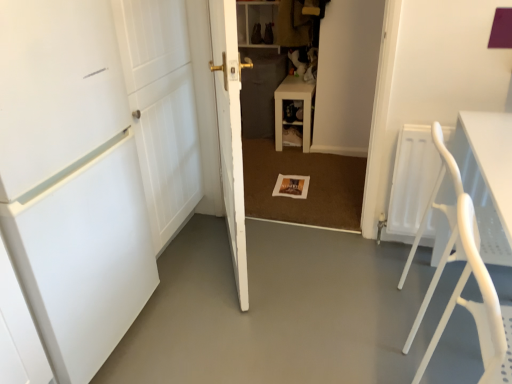
In order to face white matte door at left, which is the 1th door in left-to-right order, should I rotate leftwards or rightwards?

It's best to rotate left around 28.902 degrees.

Where is `white matte door at left, which is the 1th door in left-to-right order`? The height and width of the screenshot is (384, 512). white matte door at left, which is the 1th door in left-to-right order is located at coordinates (71, 181).

The height and width of the screenshot is (384, 512). What are the coordinates of `white plastic folding chair at right` in the screenshot? It's located at (448, 223).

Find the location of a particular element. The image size is (512, 384). wooden shelf at center is located at coordinates (294, 100).

The height and width of the screenshot is (384, 512). I want to click on white matte door at center, the 1th door from the right, so click(230, 134).

Locate an element on the screen. Image resolution: width=512 pixels, height=384 pixels. smooth concrete floor at center is located at coordinates click(281, 310).

Is white matte door at center, the second door when ordered from left to right, smaller than white matte door at left, which is the 1th door in left-to-right order?

Correct, white matte door at center, the second door when ordered from left to right, occupies less space than white matte door at left, which is the 1th door in left-to-right order.

Is white matte door at center, the 1th door from the right, far from white matte door at left, which is the 1th door in left-to-right order?

No, there isn't a large distance between white matte door at center, the 1th door from the right, and white matte door at left, which is the 1th door in left-to-right order.

Considering the points (214, 51) and (129, 208), which point is in front, point (214, 51) or point (129, 208)?

The point (129, 208) is closer.

Is white matte door at center, the second door when ordered from left to right, completely or partially outside of white matte door at left, which is the 1th door in left-to-right order?

Yes, white matte door at center, the second door when ordered from left to right, is outside of white matte door at left, which is the 1th door in left-to-right order.

From the image's perspective, is white plastic folding chair at right positioned above or below white matte door at left, the second door in the right-to-left sequence?

white plastic folding chair at right is below white matte door at left, the second door in the right-to-left sequence.

Is white plastic folding chair at right looking in the opposite direction of white matte door at left, the second door in the right-to-left sequence?

Yes, white plastic folding chair at right's orientation is away from white matte door at left, the second door in the right-to-left sequence.

Based on the photo, can you confirm if white plastic folding chair at right is shorter than white matte door at left, the second door in the right-to-left sequence?

Correct, white plastic folding chair at right is not as tall as white matte door at left, the second door in the right-to-left sequence.

Where is `folding chair behind the white matte door at left, the second door in the right-to-left sequence`? Image resolution: width=512 pixels, height=384 pixels. folding chair behind the white matte door at left, the second door in the right-to-left sequence is located at coordinates (448, 223).

Can you confirm if wooden shelf at center is shorter than white plastic folding chair at right?

Correct, wooden shelf at center is not as tall as white plastic folding chair at right.

Considering the relative positions of wooden shelf at center and white plastic folding chair at right in the image provided, is wooden shelf at center to the right of white plastic folding chair at right from the viewer's perspective?

No, wooden shelf at center is not to the right of white plastic folding chair at right.

Is wooden shelf at center spatially inside white plastic folding chair at right, or outside of it?

wooden shelf at center exists outside the volume of white plastic folding chair at right.

Is wooden shelf at center positioned far away from white plastic folding chair at right?

Yes.

Between white matte door at left, the second door in the right-to-left sequence, and white matte door at center, the 1th door from the right, which one is positioned in front?

white matte door at left, the second door in the right-to-left sequence, is in front.

In the scene shown: In terms of height, does white matte door at left, the second door in the right-to-left sequence, look taller or shorter compared to white matte door at center, the 1th door from the right?

white matte door at left, the second door in the right-to-left sequence, is taller than white matte door at center, the 1th door from the right.

Where is `door below the white matte door at left, the second door in the right-to-left sequence (from a real-world perspective)`? The height and width of the screenshot is (384, 512). door below the white matte door at left, the second door in the right-to-left sequence (from a real-world perspective) is located at coordinates (230, 134).

Which object is closer to the camera, white matte door at center, the 1th door from the right, or smooth concrete floor at center?

Positioned in front is smooth concrete floor at center.

Considering the positions of objects white matte door at center, the second door when ordered from left to right, and smooth concrete floor at center in the image provided, who is more to the right, white matte door at center, the second door when ordered from left to right, or smooth concrete floor at center?

smooth concrete floor at center is more to the right.

The width and height of the screenshot is (512, 384). Identify the location of door that is the 1st one above the smooth concrete floor at center (from a real-world perspective). (230, 134).

Which of these two, white matte door at center, the second door when ordered from left to right, or smooth concrete floor at center, is smaller?

smooth concrete floor at center is smaller.

Can you confirm if wooden shelf at center is positioned to the left of white matte door at center, the 1th door from the right?

Incorrect, wooden shelf at center is not on the left side of white matte door at center, the 1th door from the right.

Which object is wider, wooden shelf at center or white matte door at center, the second door when ordered from left to right?

wooden shelf at center.

Looking at this image, would you say wooden shelf at center is inside or outside white matte door at center, the 1th door from the right?

wooden shelf at center is outside white matte door at center, the 1th door from the right.

Is wooden shelf at center positioned with its back to white matte door at center, the 1th door from the right?

wooden shelf at center does not have its back to white matte door at center, the 1th door from the right.

Is smooth concrete floor at center facing away from white plastic folding chair at right?

smooth concrete floor at center is not turned away from white plastic folding chair at right.

Between smooth concrete floor at center and white plastic folding chair at right, which one has smaller width?

white plastic folding chair at right.

How many degrees apart are the facing directions of smooth concrete floor at center and white plastic folding chair at right?

They differ by 90 degrees in their facing directions.

Where is `door above the white matte door at left, the second door in the right-to-left sequence (from the image's perspective)`? Image resolution: width=512 pixels, height=384 pixels. door above the white matte door at left, the second door in the right-to-left sequence (from the image's perspective) is located at coordinates (230, 134).

Where is `folding chair that appears below the white matte door at left, the second door in the right-to-left sequence (from a real-world perspective)`? This screenshot has width=512, height=384. folding chair that appears below the white matte door at left, the second door in the right-to-left sequence (from a real-world perspective) is located at coordinates (448, 223).

From the image, which object appears to be farther from white matte door at left, the second door in the right-to-left sequence, wooden shelf at center or white matte door at center, the second door when ordered from left to right?

Among the two, wooden shelf at center is located further to white matte door at left, the second door in the right-to-left sequence.

Considering their positions, is white matte door at left, the second door in the right-to-left sequence, positioned closer to white matte door at center, the second door when ordered from left to right, than white plastic folding chair at right?

white matte door at left, the second door in the right-to-left sequence, lies closer to white matte door at center, the second door when ordered from left to right, than the other object.

From the image, which object appears to be farther from white plastic folding chair at right, white matte door at left, the second door in the right-to-left sequence, or smooth concrete floor at center?

white matte door at left, the second door in the right-to-left sequence.

When comparing their distances from wooden shelf at center, does white plastic folding chair at right or white matte door at center, the 1th door from the right, seem closer?

Among the two, white matte door at center, the 1th door from the right, is located nearer to wooden shelf at center.

When comparing their distances from smooth concrete floor at center, does wooden shelf at center or white matte door at center, the second door when ordered from left to right, seem closer?

white matte door at center, the second door when ordered from left to right.

Which object lies further to the anchor point smooth concrete floor at center, white matte door at left, which is the 1th door in left-to-right order, or white matte door at center, the 1th door from the right?

white matte door at left, which is the 1th door in left-to-right order, is further to smooth concrete floor at center.

Estimate the real-world distances between objects in this image. Which object is further from white matte door at center, the second door when ordered from left to right, wooden shelf at center or white plastic folding chair at right?

wooden shelf at center is positioned further to the anchor white matte door at center, the second door when ordered from left to right.

From the picture: Based on their spatial positions, is smooth concrete floor at center or white matte door at left, the second door in the right-to-left sequence, closer to white plastic folding chair at right?

Based on the image, smooth concrete floor at center appears to be nearer to white plastic folding chair at right.

Find the location of a particular element. This screenshot has width=512, height=384. concrete located between white matte door at left, which is the 1th door in left-to-right order, and wooden shelf at center in the depth direction is located at coordinates (281, 310).

Find the location of a particular element. The image size is (512, 384). concrete between white plastic folding chair at right and wooden shelf at center in the front-back direction is located at coordinates (281, 310).

Where is `door between white matte door at left, which is the 1th door in left-to-right order, and wooden shelf at center from front to back`? door between white matte door at left, which is the 1th door in left-to-right order, and wooden shelf at center from front to back is located at coordinates (230, 134).

Locate an element on the screen. concrete situated between white matte door at center, the 1th door from the right, and white plastic folding chair at right from left to right is located at coordinates (281, 310).